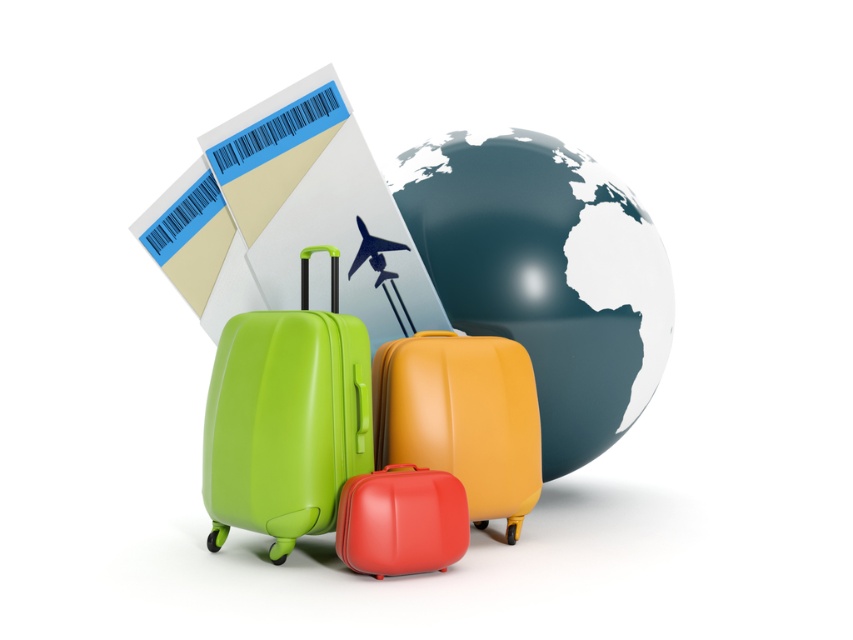
You are packing for a trip and need to place your matte orange suitcase at center near the shiny metallic globe at center. How far apart are they?

The distance between the shiny metallic globe at center and the matte orange suitcase at center is 13.18 inches.

What object is located at the coordinates point (546,275)?

The shiny metallic globe at center is located at point (546,275).